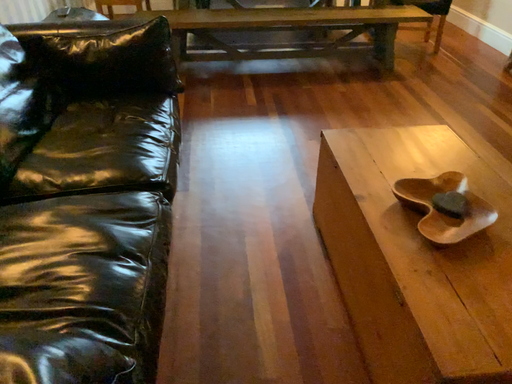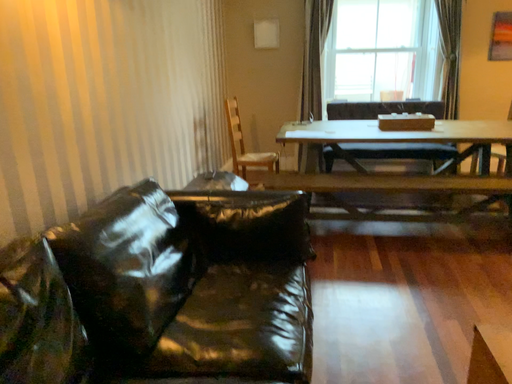
Question: Which way did the camera rotate in the video?

Choices:
 (A) rotated left
 (B) rotated right

Answer: (A)